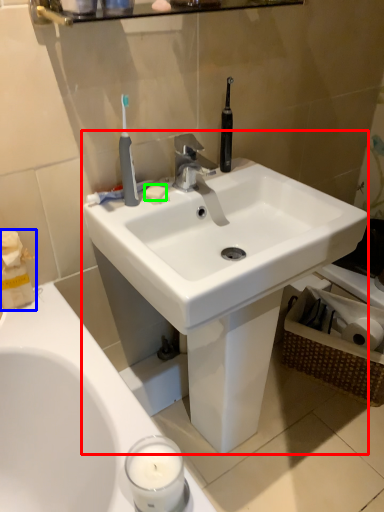
Question: Which is nearer to the sink (highlighted by a red box)? tissue (highlighted by a blue box) or soap (highlighted by a green box).

Choices:
 (A) tissue
 (B) soap

Answer: (B)